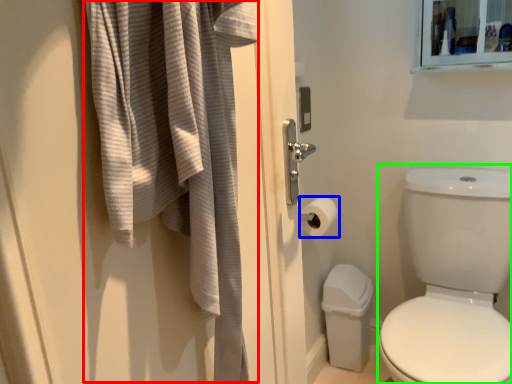
Question: Considering the real-world distances, which object is farthest from bath towel (highlighted by a red box)? toilet paper (highlighted by a blue box) or toilet bowl (highlighted by a green box)?

Choices:
 (A) toilet paper
 (B) toilet bowl

Answer: (B)